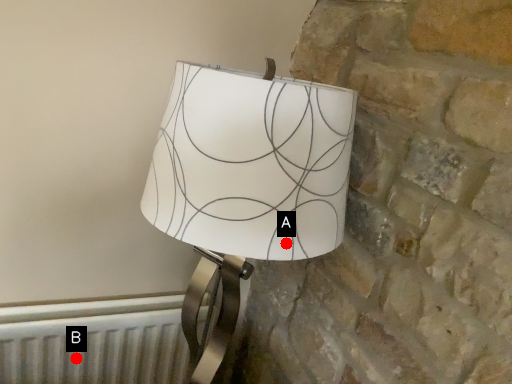
Question: Two points are circled on the image, labeled by A and B beside each circle. Which point is closer to the camera taking this photo?

Choices:
 (A) A is closer
 (B) B is closer

Answer: (A)